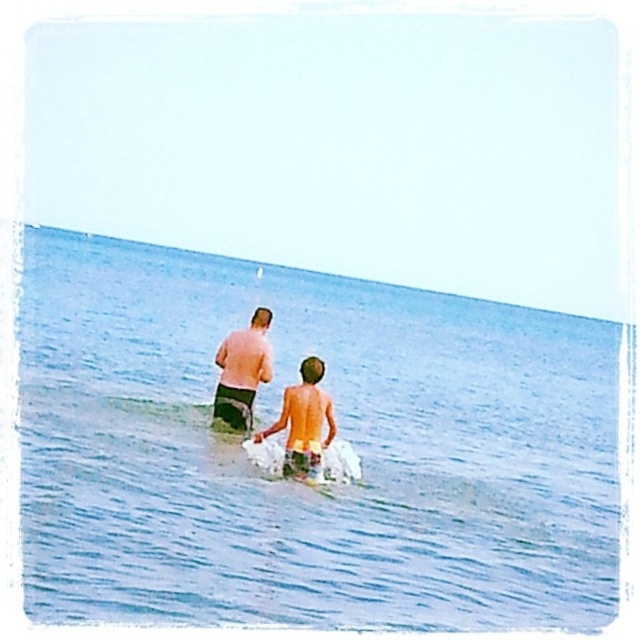
Question: Can you confirm if matte black shorts at center is positioned below tan skin boy at center?

Choices:
 (A) no
 (B) yes

Answer: (A)

Question: Which object is the farthest from the tan skin boy at center?

Choices:
 (A) blue water at center
 (B) matte black shorts at center

Answer: (A)

Question: Observing the image, what is the correct spatial positioning of blue water at center in reference to tan skin boy at center?

Choices:
 (A) below
 (B) above

Answer: (B)

Question: Which object is closer to the camera taking this photo?

Choices:
 (A) tan skin boy at center
 (B) matte black shorts at center
 (C) blue water at center

Answer: (C)

Question: Does blue water at center have a larger size compared to tan skin boy at center?

Choices:
 (A) yes
 (B) no

Answer: (A)

Question: Which object is positioned farthest from the blue water at center?

Choices:
 (A) matte black shorts at center
 (B) tan skin boy at center

Answer: (B)